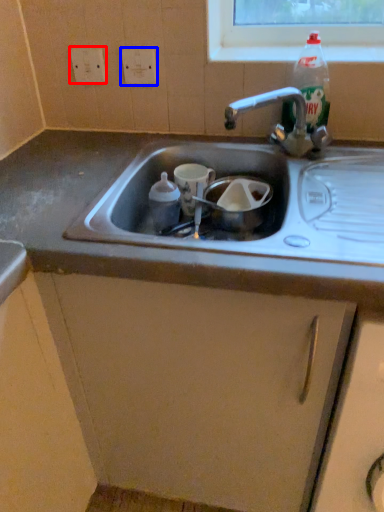
Question: Which of the following is the farthest to the observer, electric outlet (highlighted by a red box) or electric outlet (highlighted by a blue box)?

Choices:
 (A) electric outlet
 (B) electric outlet

Answer: (A)